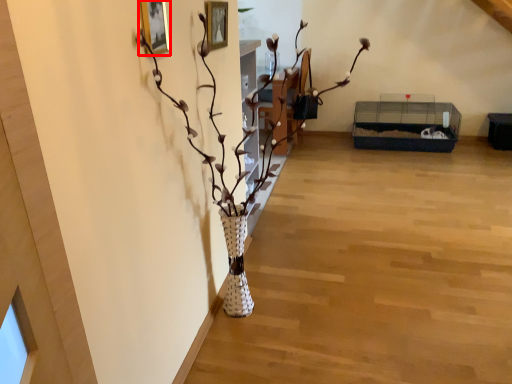
Question: From the image's perspective, what is the correct spatial positioning of picture frame (annotated by the red box) in reference to houseplant?

Choices:
 (A) below
 (B) above

Answer: (B)